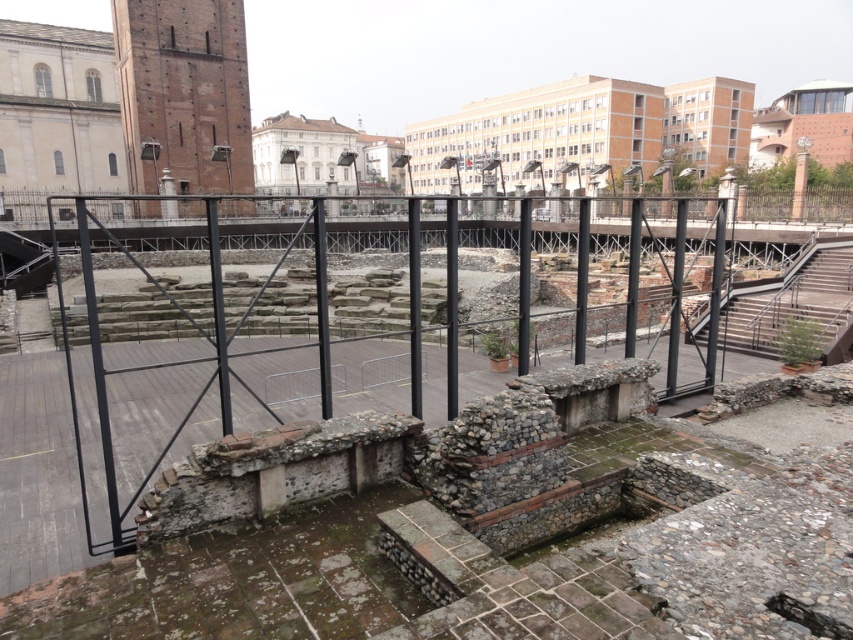
You are standing at the center of the archaeological site and want to locate the brick tower at upper left. According to the coordinates provided, where should you look to find it?

The brick tower at upper left is located at coordinates point (183, 93), which means you should look towards the upper left direction from your current position to find it.

You are an archaeologist planning to walk from the brick tower at upper left to the rustic stone stairs at right. Based on the distance between them, do you think you can complete this journey in a single breath without stopping?

The brick tower at upper left and rustic stone stairs at right are 137.06 feet apart from each other. Assuming an average walking pace covers about 5 feet per second, this distance would take roughly 27 seconds to walk. Most people can hold their breath for around 30 seconds, so it is theoretically possible to complete the journey in a single breath without stopping.

You are a tour guide leading a group through the archaeological site. You want to point out both the brick tower at upper left and the rustic stone stairs at right to your visitors. Which one is closer to the front of the site?

The brick tower at upper left is closer to the front of the site because the rustic stone stairs at right is behind it.